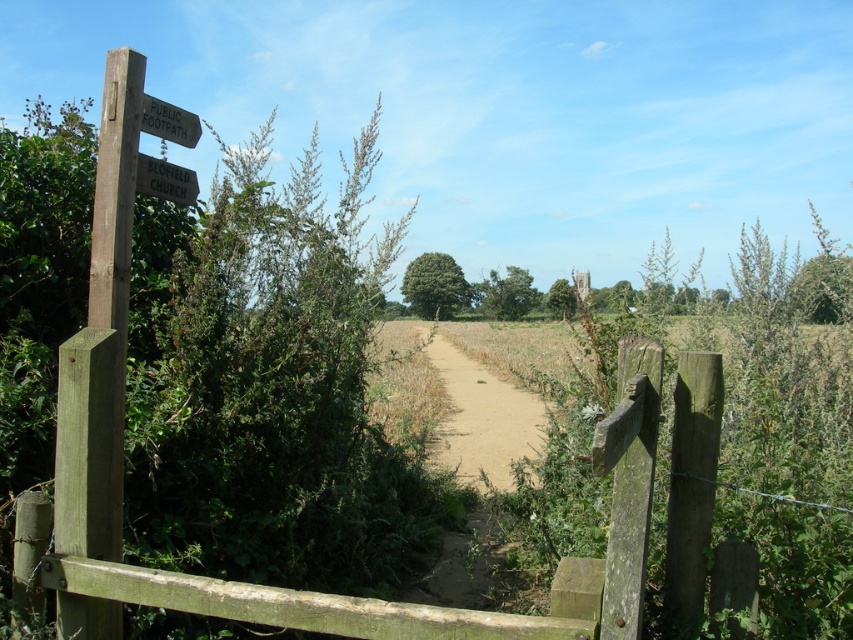
Is point (416, 632) closer to viewer compared to point (165, 134)?

Yes, point (416, 632) is closer to viewer.

Identify the location of wooden gate at center. (314, 592).

Between point (102, 541) and point (175, 173), which one is positioned in front?

Positioned in front is point (102, 541).

Can you confirm if wooden gate at center is positioned to the left of wooden signpost at left?

No, wooden gate at center is not to the left of wooden signpost at left.

Does point (643, 556) come closer to viewer compared to point (136, 161)?

Yes, it is in front of point (136, 161).

Identify the location of wooden gate at center. This screenshot has width=853, height=640. (314, 592).

Is dirt path at center thinner than wooden signpost at upper left?

Answer: Incorrect, dirt path at center's width is not less than wooden signpost at upper left's.

Between dirt path at center and wooden signpost at upper left, which one is positioned higher?

wooden signpost at upper left

Image resolution: width=853 pixels, height=640 pixels. Find the location of `dirt path at center`. dirt path at center is located at coordinates (480, 417).